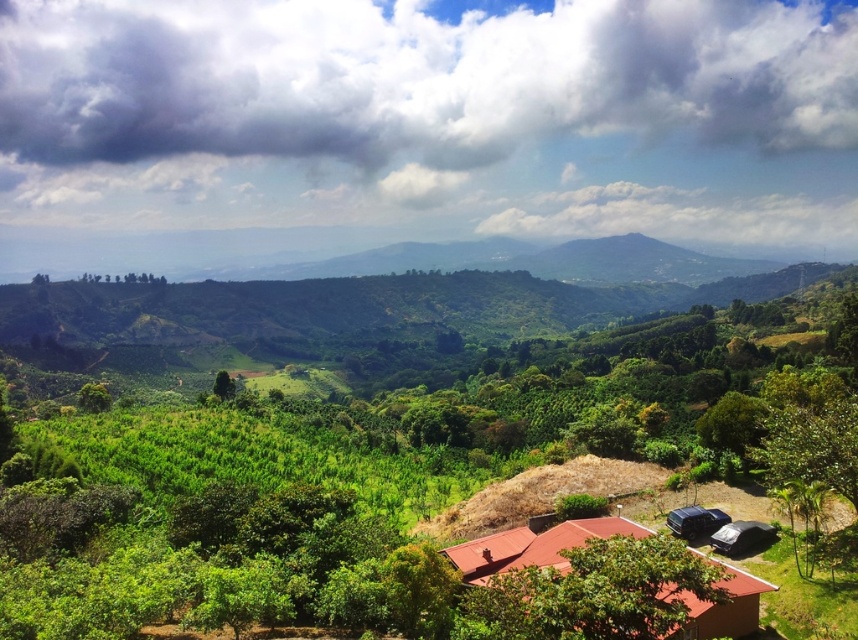
Which is in front, point (257, 20) or point (669, 589)?

Point (669, 589) is in front.

The width and height of the screenshot is (858, 640). In order to click on cloudy sky at upper center in this screenshot , I will do `click(402, 88)`.

Can you confirm if cloudy sky at upper center is positioned above green leafy tree at center-left?

Indeed, cloudy sky at upper center is positioned over green leafy tree at center-left.

Is cloudy sky at upper center in front of green leafy tree at center-left?

No.

Does point (735, 90) come closer to viewer compared to point (91, 387)?

No, (735, 90) is behind (91, 387).

Image resolution: width=858 pixels, height=640 pixels. What are the coordinates of `cloudy sky at upper center` in the screenshot? It's located at (402, 88).

Is point (650, 65) in front of point (216, 388)?

No, it is behind (216, 388).

Who is more forward, (x=770, y=8) or (x=225, y=371)?

Point (x=225, y=371) is more forward.

From the picture: Who is more distant from viewer, (198, 29) or (227, 372)?

Point (198, 29)

Find the location of `cloudy sky at upper center`. cloudy sky at upper center is located at coordinates (402, 88).